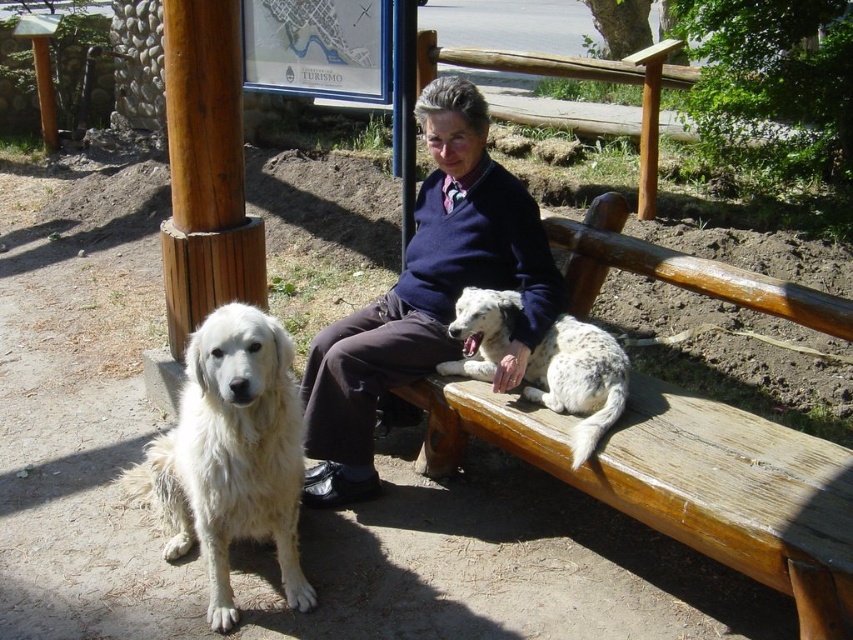
Question: Which of these objects is positioned closest to the white fluffy dog at left?

Choices:
 (A) spotted fur dog at bench center
 (B) wooden bench at center

Answer: (A)

Question: Can you confirm if dark blue sweater at center is positioned to the left of spotted fur dog at bench center?

Choices:
 (A) no
 (B) yes

Answer: (B)

Question: Which point is closer to the camera?

Choices:
 (A) (289, 502)
 (B) (509, 272)
 (C) (560, 444)
 (D) (573, 454)

Answer: (D)

Question: Which object appears farthest from the camera in this image?

Choices:
 (A) white fluffy dog at left
 (B) wooden bench at center
 (C) dark blue sweater at center
 (D) spotted fur dog at bench center

Answer: (C)

Question: Where is white fluffy dog at left located in relation to spotted fur dog at bench center in the image?

Choices:
 (A) above
 (B) below

Answer: (B)

Question: Is wooden bench at center smaller than spotted fur dog at bench center?

Choices:
 (A) yes
 (B) no

Answer: (B)